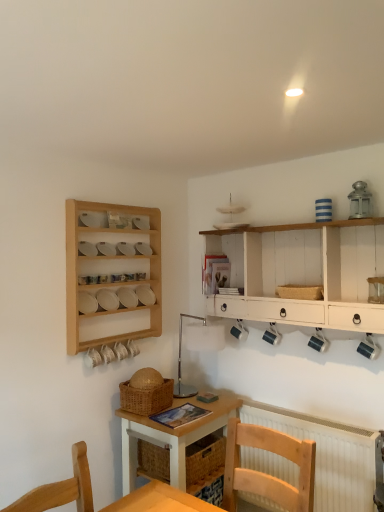
Question: From a real-world perspective, is white wood shelf at upper right located higher than white textured radiator at lower right?

Choices:
 (A) yes
 (B) no

Answer: (A)

Question: Is white wood shelf at upper right placed right next to white textured radiator at lower right?

Choices:
 (A) yes
 (B) no

Answer: (B)

Question: Does white wood shelf at upper right come behind white textured radiator at lower right?

Choices:
 (A) yes
 (B) no

Answer: (B)

Question: Can you confirm if white wood shelf at upper right is smaller than white textured radiator at lower right?

Choices:
 (A) yes
 (B) no

Answer: (B)

Question: Considering the relative sizes of white wood shelf at upper right and white textured radiator at lower right in the image provided, is white wood shelf at upper right bigger than white textured radiator at lower right?

Choices:
 (A) no
 (B) yes

Answer: (B)

Question: Looking at their shapes, would you say light wood desk at center is wider or thinner than woven brown basket at center, positioned as the 1th basket in left-to-right order?

Choices:
 (A) wide
 (B) thin

Answer: (A)

Question: From their relative heights in the image, would you say light wood desk at center is taller or shorter than woven brown basket at center, placed as the 2th basket when sorted from right to left?

Choices:
 (A) short
 (B) tall

Answer: (B)

Question: From the image's perspective, is light wood desk at center above or below woven brown basket at center, positioned as the 1th basket in left-to-right order?

Choices:
 (A) below
 (B) above

Answer: (A)

Question: Is light wood desk at center situated inside woven brown basket at center, positioned as the 1th basket in left-to-right order, or outside?

Choices:
 (A) inside
 (B) outside

Answer: (B)

Question: In terms of width, does light wood desk at center look wider or thinner when compared to wooden chair at lower center?

Choices:
 (A) wide
 (B) thin

Answer: (B)

Question: Considering the positions of light wood desk at center and wooden chair at lower center in the image, is light wood desk at center bigger or smaller than wooden chair at lower center?

Choices:
 (A) big
 (B) small

Answer: (A)

Question: From the image's perspective, is light wood desk at center located above or below wooden chair at lower center?

Choices:
 (A) below
 (B) above

Answer: (A)

Question: Considering the positions of light wood desk at center and wooden chair at lower center in the image, is light wood desk at center taller or shorter than wooden chair at lower center?

Choices:
 (A) short
 (B) tall

Answer: (B)

Question: From a real-world perspective, relative to wooden shelf at left, is wooden chair at lower center vertically above or below?

Choices:
 (A) above
 (B) below

Answer: (B)

Question: From the image's perspective, is wooden chair at lower center above or below wooden shelf at left?

Choices:
 (A) below
 (B) above

Answer: (A)